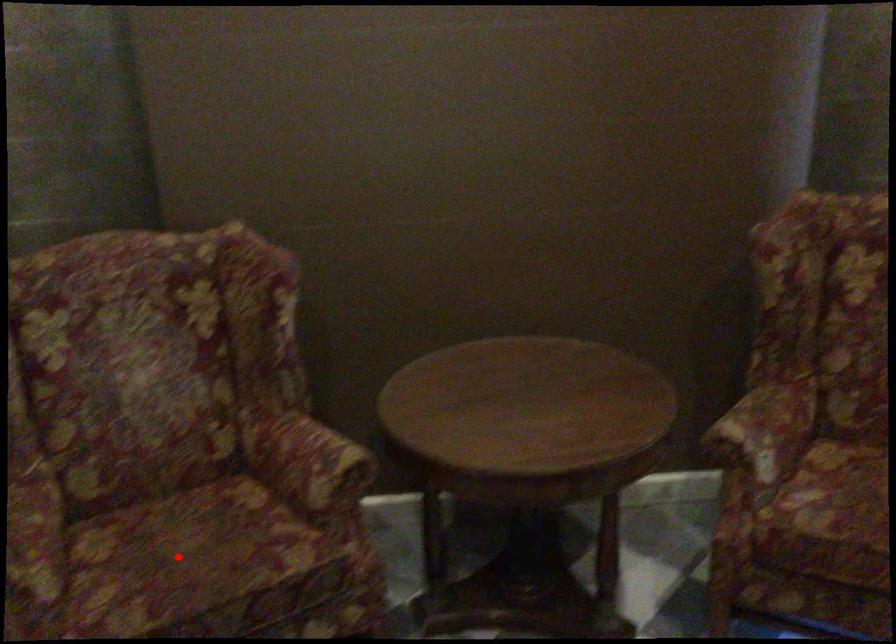
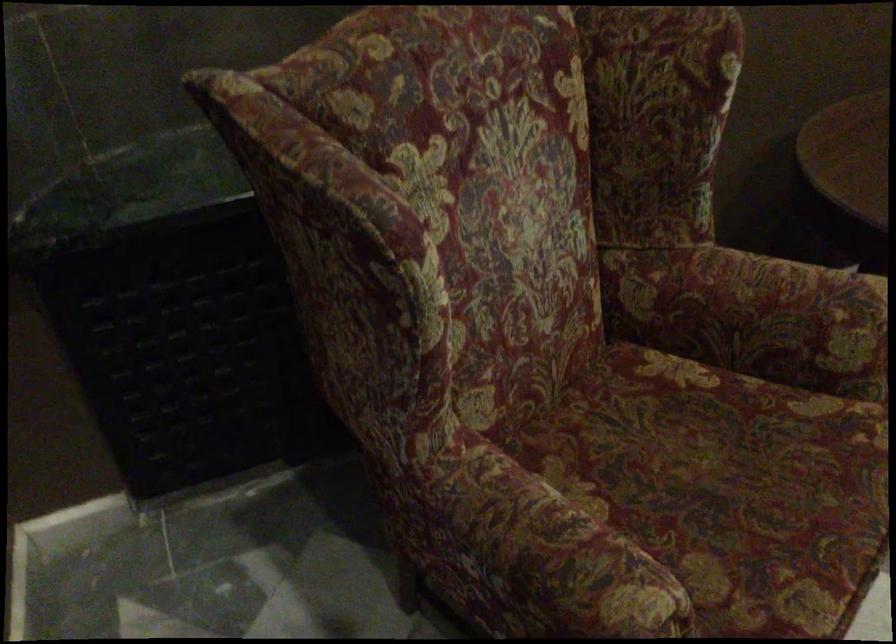
Locate, in the second image, the point that corresponds to the highlighted location in the first image.

(726, 486)